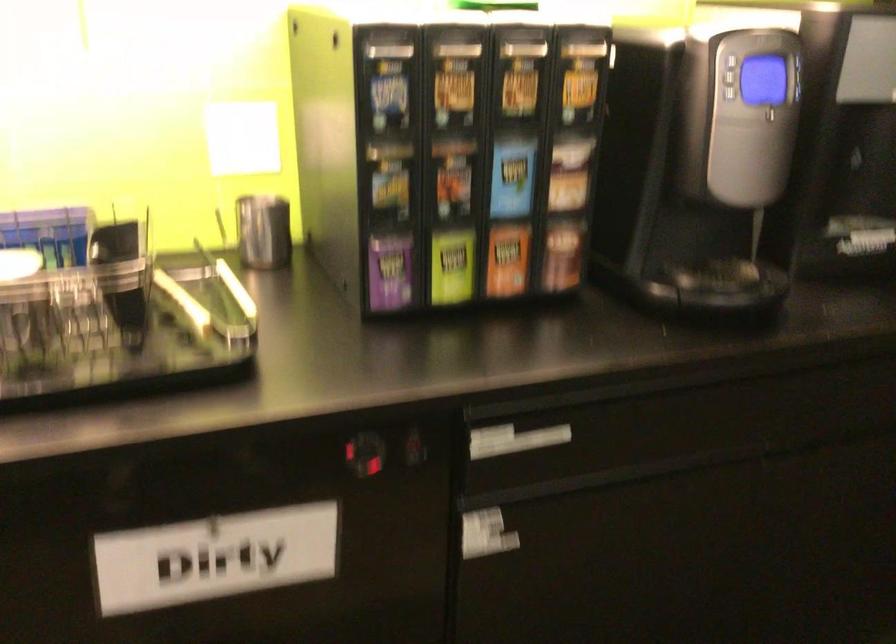
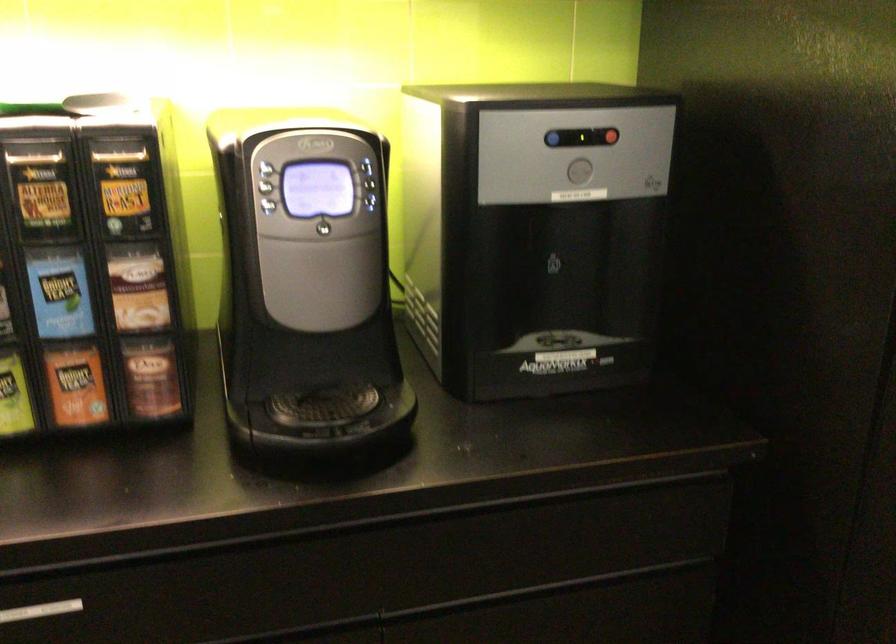
The point at [771,108] is marked in the first image. Where is the corresponding point in the second image?

(323, 222)